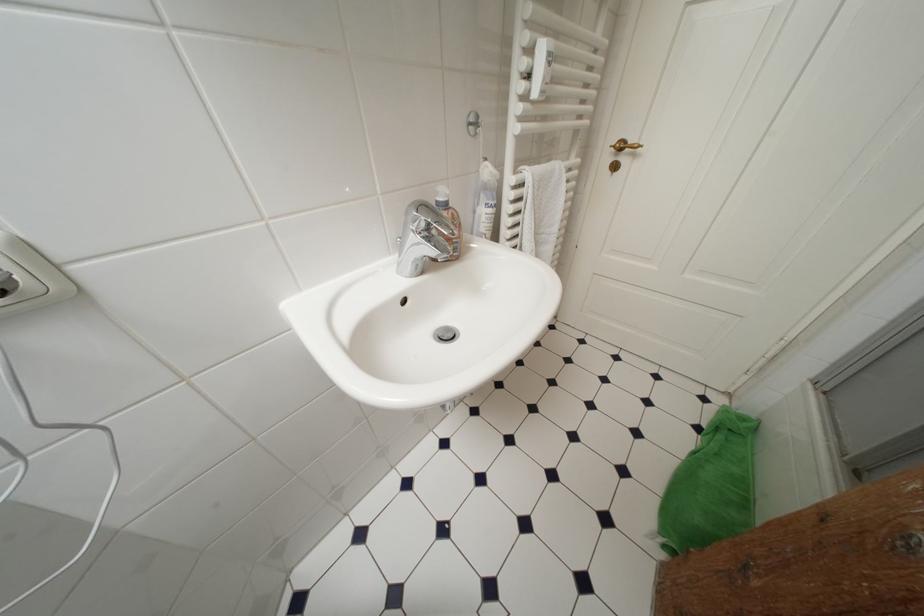
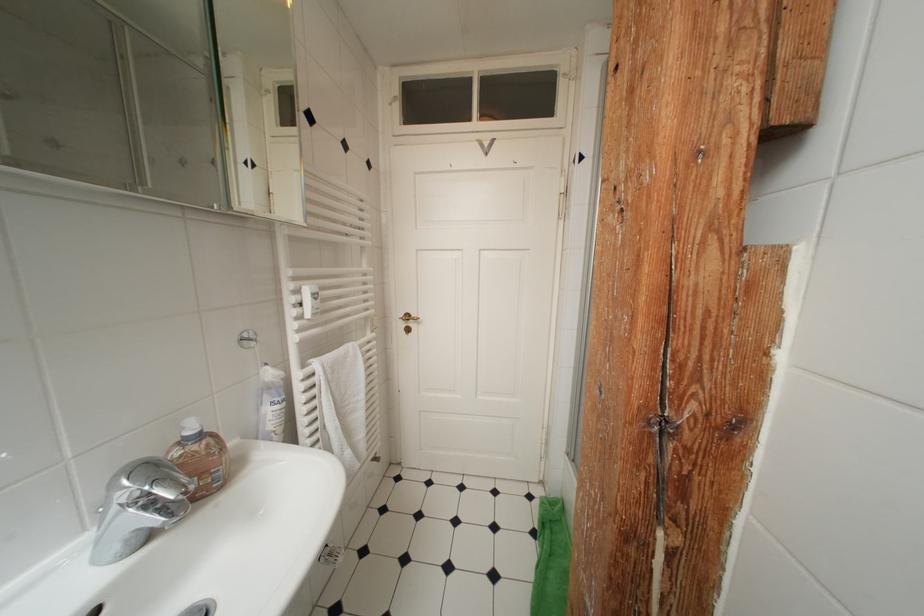
The point at (492,161) is marked in the first image. Where is the corresponding point in the second image?

(274, 368)